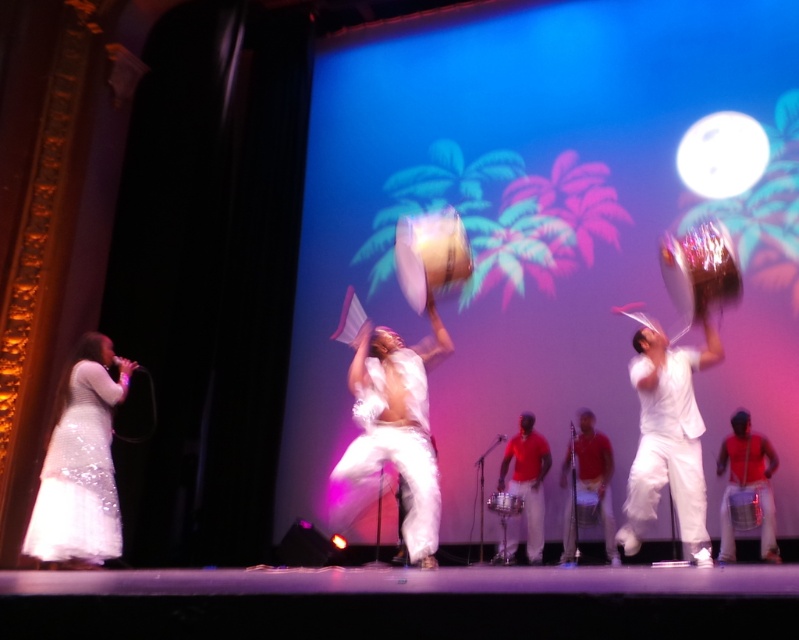
Question: Which object is positioned closest to the white sequined dress at left?

Choices:
 (A) shiny red drum at right
 (B) red matte shirt at center

Answer: (B)

Question: Does white sequined dress at left appear over shiny red drum at right?

Choices:
 (A) no
 (B) yes

Answer: (B)

Question: Which point is farther to the camera?

Choices:
 (A) red cotton shirt at center
 (B) red matte shirt at center
 (C) shiny red drum at right

Answer: (B)

Question: Which of these objects is positioned closest to the white sequined dress at left?

Choices:
 (A) shiny red drum at right
 (B) red matte shirt at center
 (C) red cotton shirt at center
 (D) white matte drum at center

Answer: (D)

Question: Can you confirm if red matte shirt at center is thinner than red cotton shirt at center?

Choices:
 (A) yes
 (B) no

Answer: (B)

Question: Does white matte drum at center appear under red matte shirt at center?

Choices:
 (A) no
 (B) yes

Answer: (A)